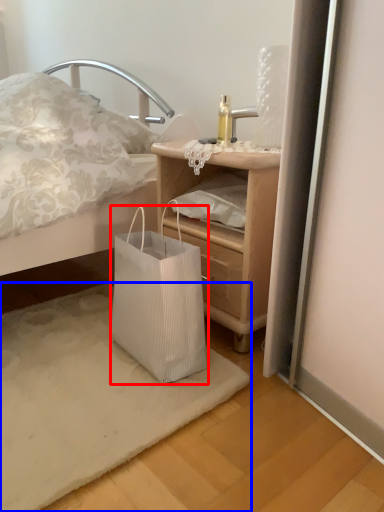
Question: Which object is closer to the camera taking this photo, bag (highlighted by a red box) or mat (highlighted by a blue box)?

Choices:
 (A) bag
 (B) mat

Answer: (B)